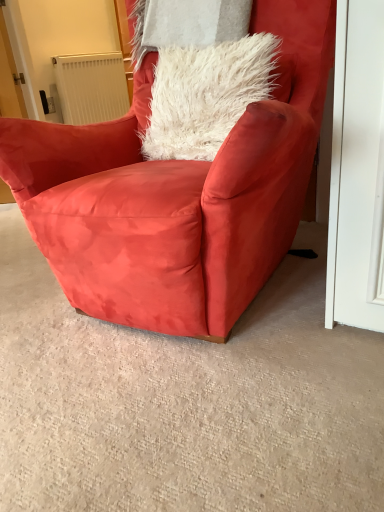
Question: Is white plastic radiator at upper left behind suede red armchair at center?

Choices:
 (A) no
 (B) yes

Answer: (B)

Question: Is white plastic radiator at upper left far from suede red armchair at center?

Choices:
 (A) yes
 (B) no

Answer: (A)

Question: Considering the relative sizes of white plastic radiator at upper left and suede red armchair at center in the image provided, is white plastic radiator at upper left thinner than suede red armchair at center?

Choices:
 (A) no
 (B) yes

Answer: (B)

Question: Does white plastic radiator at upper left appear on the right side of suede red armchair at center?

Choices:
 (A) yes
 (B) no

Answer: (B)

Question: From the image's perspective, is white plastic radiator at upper left beneath suede red armchair at center?

Choices:
 (A) yes
 (B) no

Answer: (B)

Question: Does white plastic radiator at upper left have a smaller size compared to suede red armchair at center?

Choices:
 (A) yes
 (B) no

Answer: (A)

Question: Considering the relative sizes of suede red armchair at center and white plastic radiator at upper left in the image provided, is suede red armchair at center taller than white plastic radiator at upper left?

Choices:
 (A) no
 (B) yes

Answer: (B)

Question: Does suede red armchair at center have a lesser height compared to white plastic radiator at upper left?

Choices:
 (A) no
 (B) yes

Answer: (A)

Question: Is suede red armchair at center thinner than white plastic radiator at upper left?

Choices:
 (A) no
 (B) yes

Answer: (A)

Question: Is suede red armchair at center closer to camera compared to white plastic radiator at upper left?

Choices:
 (A) no
 (B) yes

Answer: (B)

Question: Is the position of suede red armchair at center more distant than that of white plastic radiator at upper left?

Choices:
 (A) no
 (B) yes

Answer: (A)

Question: From the image's perspective, is suede red armchair at center on white plastic radiator at upper left?

Choices:
 (A) no
 (B) yes

Answer: (A)

Question: Is white plastic radiator at upper left to the left or to the right of suede red armchair at center in the image?

Choices:
 (A) right
 (B) left

Answer: (B)